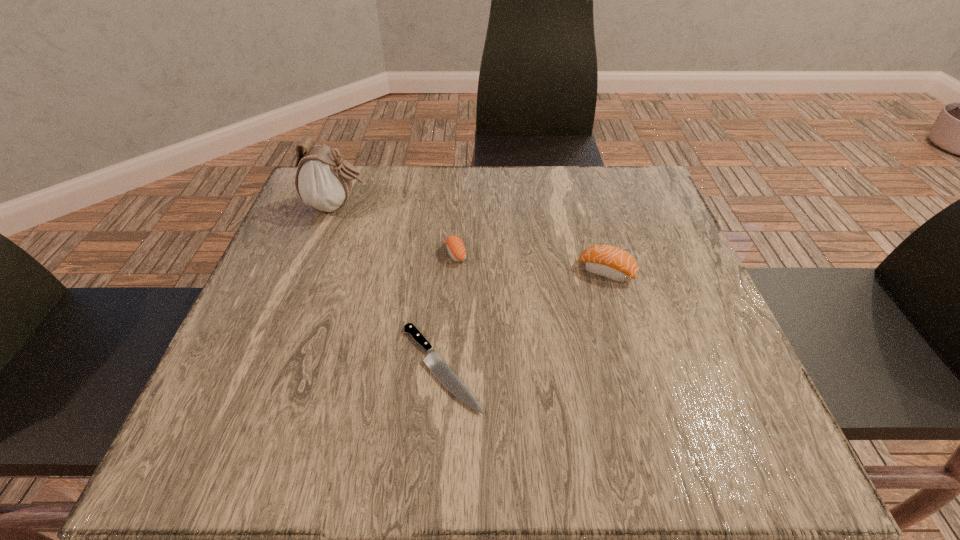
At what (x,y) coordinates should I click in order to perform the action: click on free region that satisfies the following two spatial constraints: 1. on the back side of the nearest object; 2. on the left side of the shorter sushi. Please return your answer as a coordinate pair (x, y). The image size is (960, 540). Looking at the image, I should click on (449, 254).

Image resolution: width=960 pixels, height=540 pixels. In order to click on free spot that satisfies the following two spatial constraints: 1. on the front-facing side of the farthest object; 2. on the back side of the third tallest object in this screenshot , I will do pos(321,254).

Locate an element on the screen. free space that satisfies the following two spatial constraints: 1. on the back side of the steak knife; 2. on the left side of the third shortest object is located at coordinates (448, 271).

Locate an element on the screen. The height and width of the screenshot is (540, 960). vacant space that satisfies the following two spatial constraints: 1. on the front-facing side of the right sushi; 2. on the left side of the farthest object is located at coordinates (314, 271).

Identify the location of blank area in the image that satisfies the following two spatial constraints: 1. on the front-facing side of the pouch; 2. on the left side of the shorter sushi. The height and width of the screenshot is (540, 960). (321, 254).